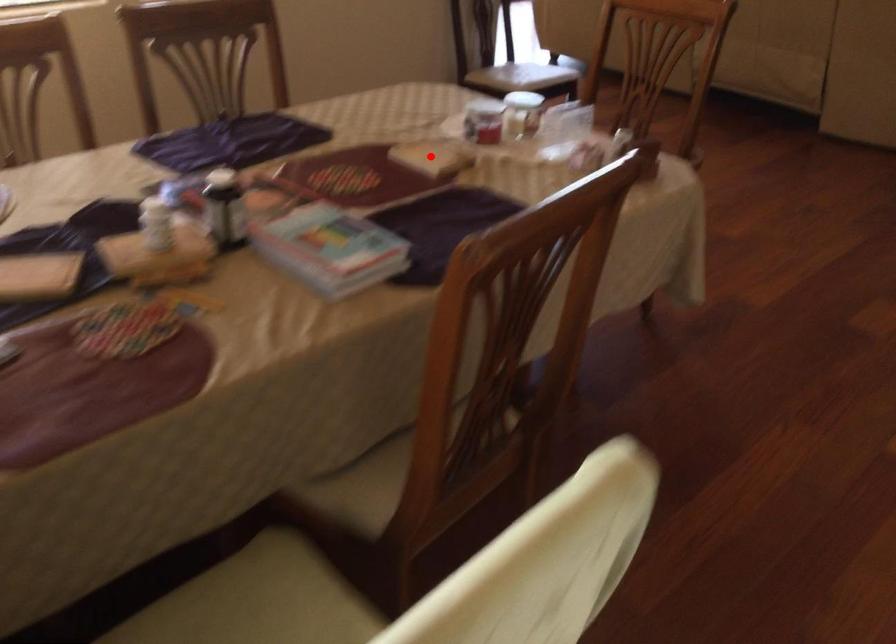
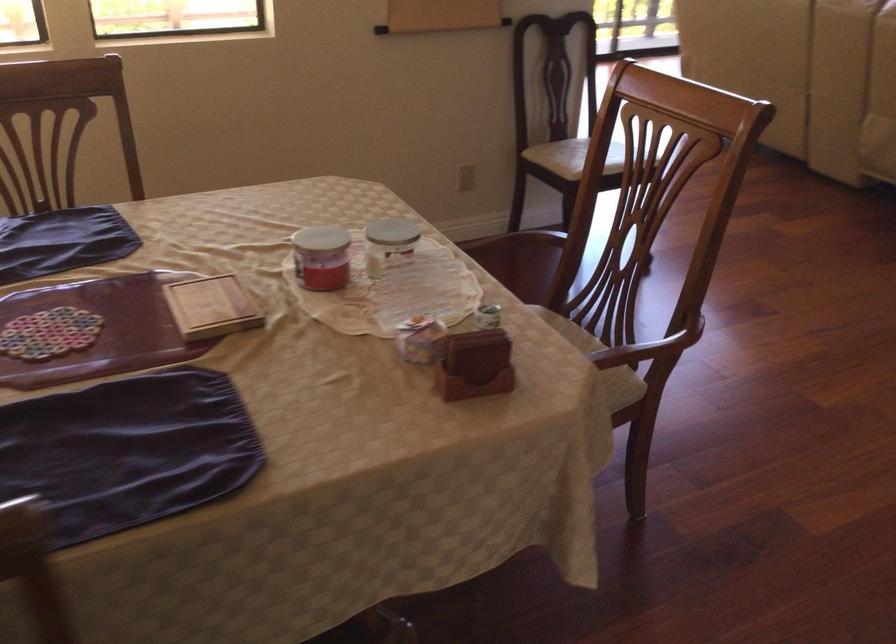
Question: I am providing you with two images of the same scene from different viewpoints. In image1, a red point is highlighted. Considering the same 3D point in image2, which of the following is correct?

Choices:
 (A) It is closer
 (B) It is farther

Answer: (A)